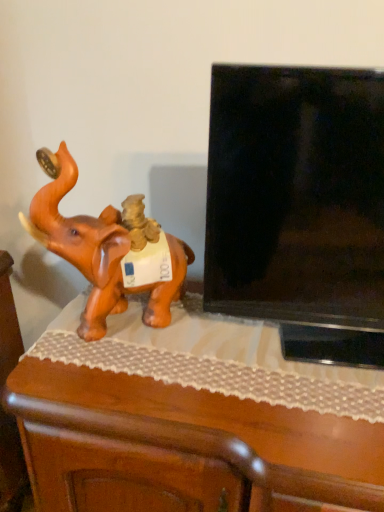
Locate an element on the screen. The width and height of the screenshot is (384, 512). vacant area located to the right-hand side of orange matte elephant at left is located at coordinates (205, 351).